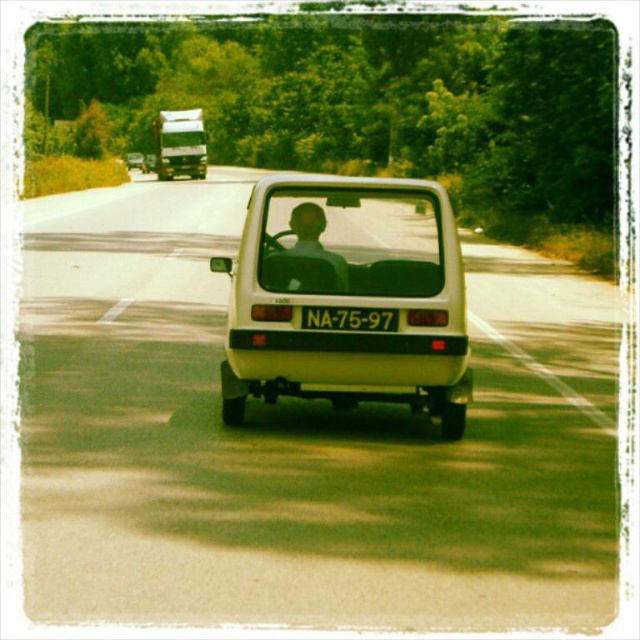
From the picture: You are standing at the center of the road and see two points marked on the road ahead. The first point is at point (163, 116) and the second point is at point (365, 314). Which point is closer to you?

Point (163, 116) is further to the camera than point (365, 314), so the point closer to you is point (365, 314).